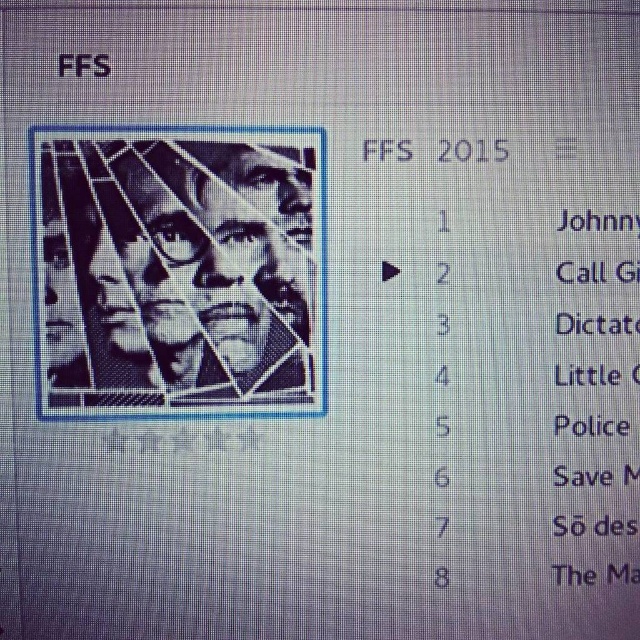
You are using a digital music player and see the playlist titled FFS 2015. The interface has a point marked at coordinates (177, 266). What object is located at that point?

The point at coordinates (177, 266) indicates the location of the black matte face at center.

You are using a digital music player and notice two elements on the screen. One is the black matte face at center and the other is the black pixelated text at upper left. Which of these two elements is taller?

The black matte face at center is taller than the black pixelated text at upper left.